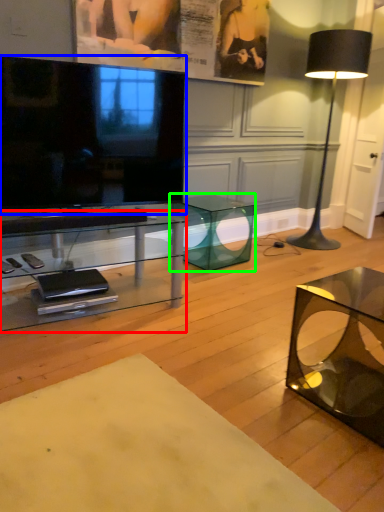
Question: Which object is positioned closest to table (highlighted by a red box)? Select from television (highlighted by a blue box) and table (highlighted by a green box).

Choices:
 (A) television
 (B) table

Answer: (A)